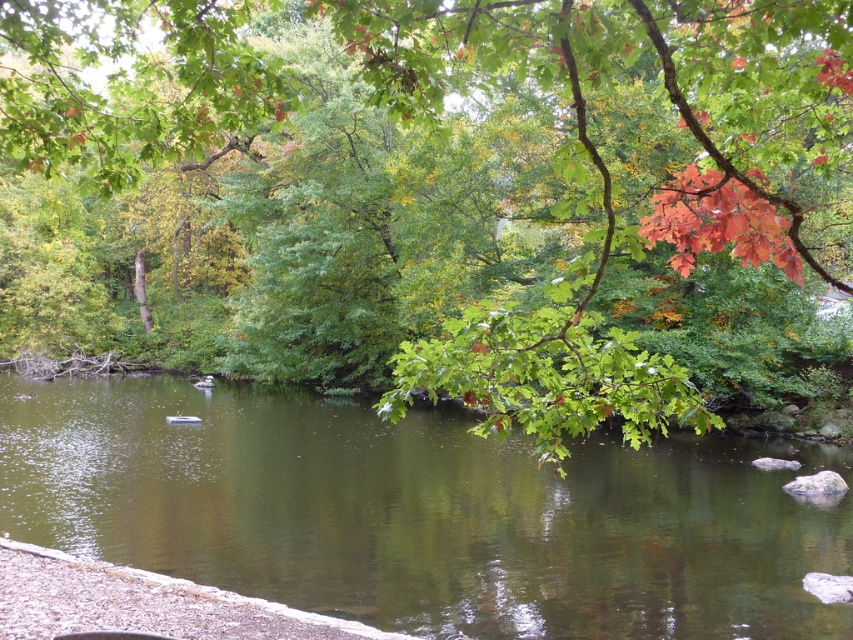
You are standing in the serene natural scene and want to take a photo of the green leafy branch at upper center. Where should you position yourself to ensure the branch is centered in your viewfinder?

The green leafy branch at upper center is located at point (437, 196), so you should position yourself directly facing that coordinate to center it in your viewfinder.

You are standing in this serene natural scene and want to take a photo of the green leafy branch at upper center and the green glossy water at center. Which object will appear larger in your photo?

The green leafy branch at upper center will appear larger in the photo because it is closer to the viewer than the green glossy water at center.